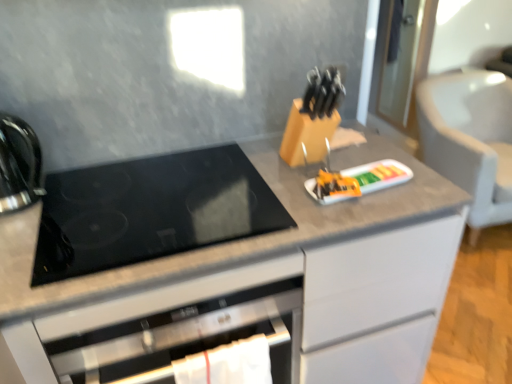
Image resolution: width=512 pixels, height=384 pixels. What are the coordinates of `unoccupied area in front of orange plastic tray at center` in the screenshot? It's located at (359, 208).